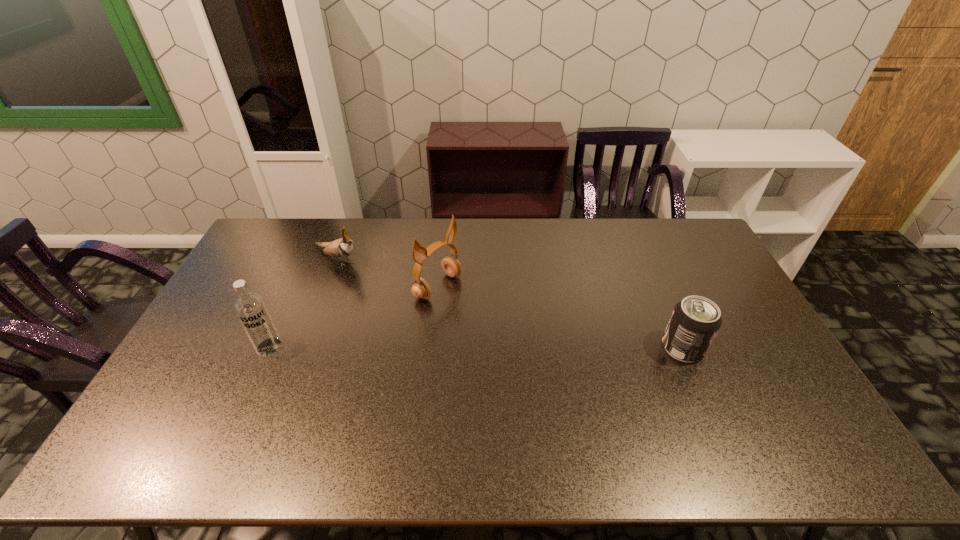
I want to click on unoccupied position between the vodka and the rightmost object, so click(476, 347).

This screenshot has width=960, height=540. What are the coordinates of `empty space that is in between the vodka and the bird` in the screenshot? It's located at (303, 302).

Identify the location of free point between the soda can and the vodka. This screenshot has height=540, width=960. (476, 347).

The width and height of the screenshot is (960, 540). I want to click on vacant area that lies between the earphone and the rightmost object, so click(561, 317).

The image size is (960, 540). In order to click on free spot between the vodka and the rightmost object in this screenshot , I will do `click(476, 347)`.

Locate an element on the screen. Image resolution: width=960 pixels, height=540 pixels. empty location between the second object from right to left and the bird is located at coordinates (388, 273).

Where is `vacant region between the bird and the rightmost object`? The height and width of the screenshot is (540, 960). vacant region between the bird and the rightmost object is located at coordinates (510, 303).

The image size is (960, 540). Identify the location of free space between the vodka and the bird. (303, 302).

Locate an element on the screen. This screenshot has height=540, width=960. free point between the vodka and the earphone is located at coordinates (353, 316).

Find the location of `object identified as the closest to the soda can`. object identified as the closest to the soda can is located at coordinates 451,266.